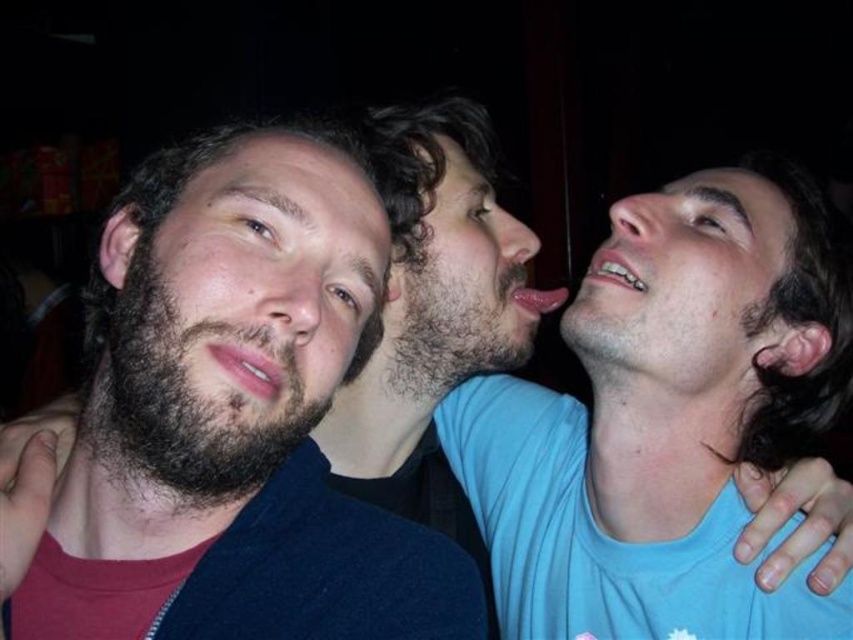
Question: Observing the image, what is the correct spatial positioning of pink matte lips at center in reference to glossy pink lips at center?

Choices:
 (A) above
 (B) below

Answer: (B)

Question: Is pink matte lips at center bigger than glossy pink lips at center?

Choices:
 (A) yes
 (B) no

Answer: (B)

Question: Which of these objects is positioned closest to the dark brown fuzzy beard at center?

Choices:
 (A) glossy pink lips at center
 (B) pink matte lips at center

Answer: (A)

Question: Which point is closer to the camera?

Choices:
 (A) pink matte lips at center
 (B) dark brown fuzzy beard at left

Answer: (B)

Question: Which object is farther from the camera taking this photo?

Choices:
 (A) smooth skin face at upper right
 (B) dark brown hair at center

Answer: (B)

Question: Is dark brown hair at center in front of glossy pink lips at center?

Choices:
 (A) yes
 (B) no

Answer: (A)